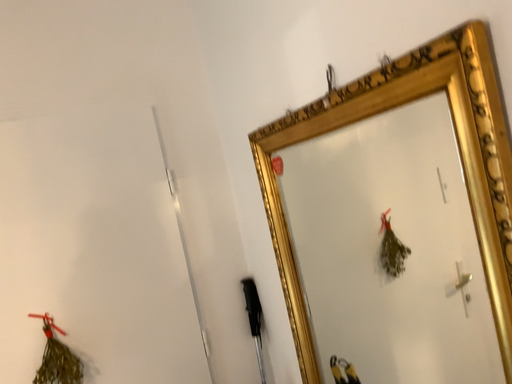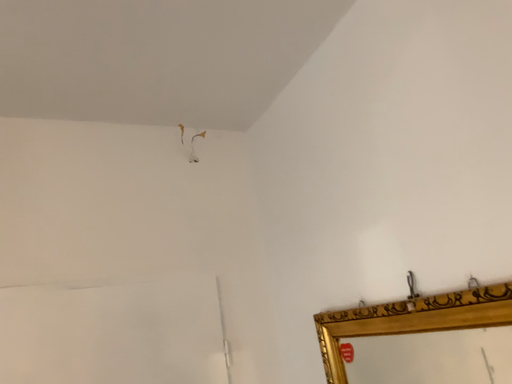
Question: Which way did the camera rotate in the video?

Choices:
 (A) rotated downward
 (B) rotated upward

Answer: (B)